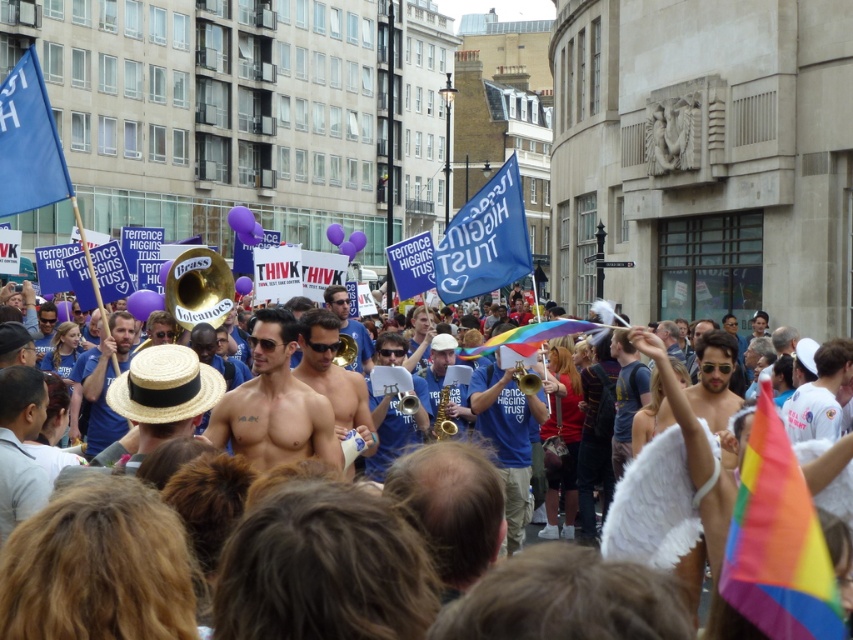
Between straw hat at center and shiny gold saxophone at center, which one appears on the right side from the viewer's perspective?

shiny gold saxophone at center

Is straw hat at center wider than shiny gold saxophone at center?

In fact, straw hat at center might be narrower than shiny gold saxophone at center.

Where is `straw hat at center`? The image size is (853, 640). straw hat at center is located at coordinates (164, 385).

Find the location of a particular element. straw hat at center is located at coordinates point(164,385).

Is point (361, 426) behind point (454, 396)?

No, it is in front of (454, 396).

Measure the distance between point (338, 340) and camera.

The distance of point (338, 340) from camera is 54.38 meters.

Image resolution: width=853 pixels, height=640 pixels. I want to click on smooth skin torso at center, so click(x=334, y=376).

Is shiny gold trumpet at center smaller than gold shiny trumpet at center?

No.

Does shiny gold trumpet at center appear on the right side of gold shiny trumpet at center?

In fact, shiny gold trumpet at center is to the left of gold shiny trumpet at center.

The image size is (853, 640). What do you see at coordinates (349, 326) in the screenshot?
I see `shiny gold trumpet at center` at bounding box center [349, 326].

Identify the location of shiny gold trumpet at center. The width and height of the screenshot is (853, 640). (349, 326).